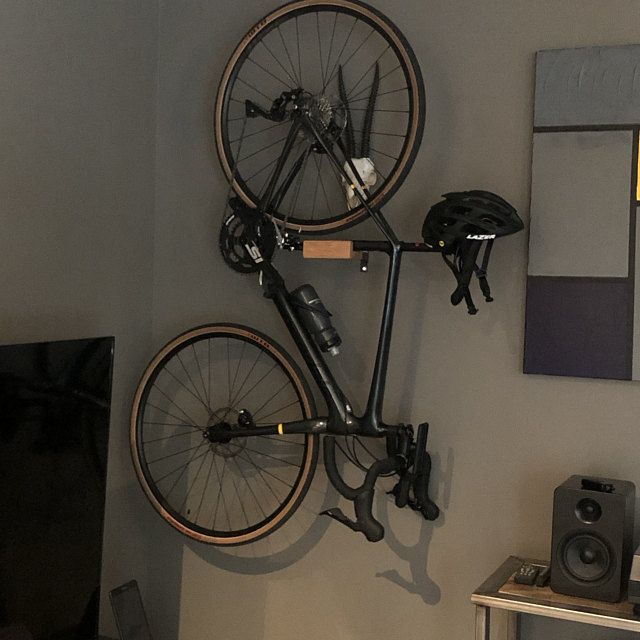
Locate an element on the screen. This screenshot has height=640, width=640. laptop is located at coordinates (140, 626).